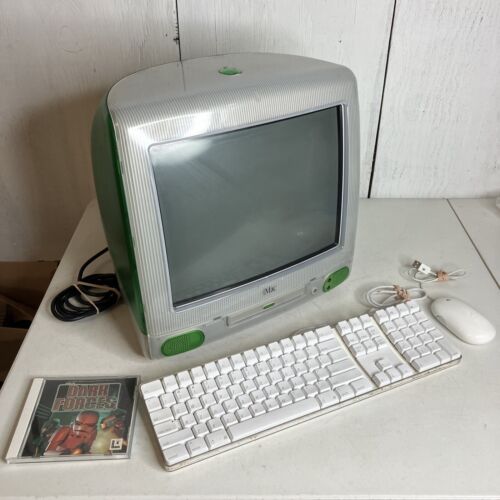
The height and width of the screenshot is (500, 500). Find the location of `monitor`. monitor is located at coordinates (253, 180).